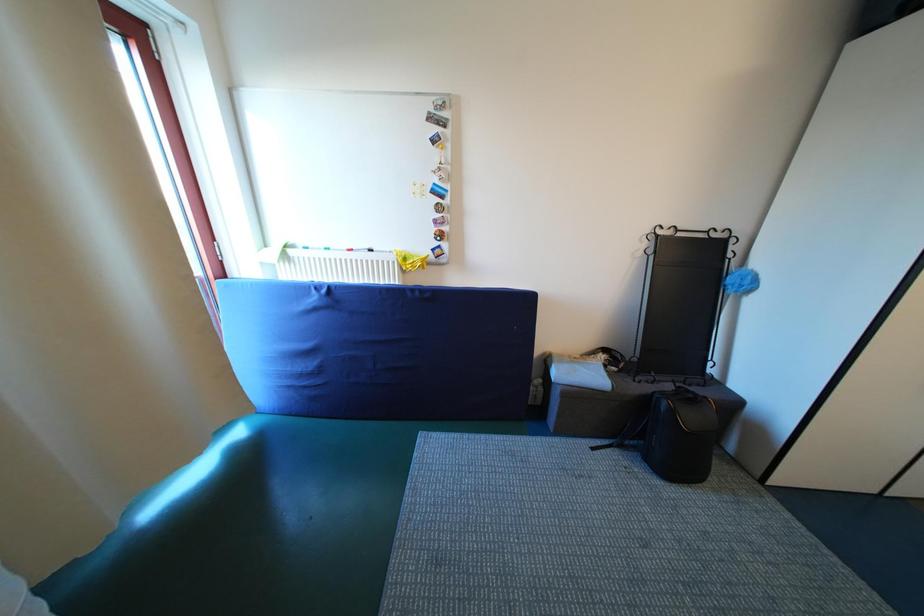
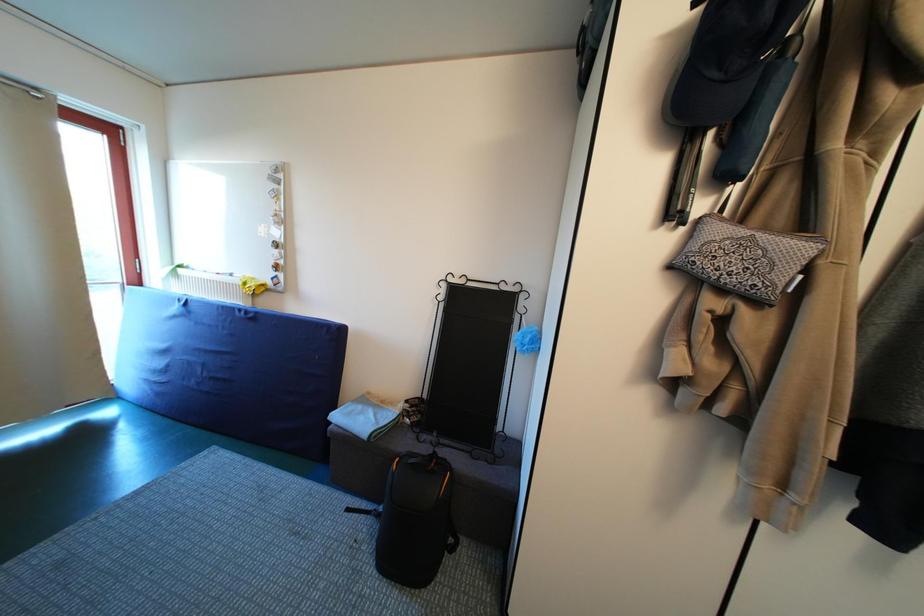
Question: The images are taken continuously from a first-person perspective. In which direction are you moving?

Choices:
 (A) Left
 (B) Right
 (C) Forward
 (D) Backward

Answer: (B)